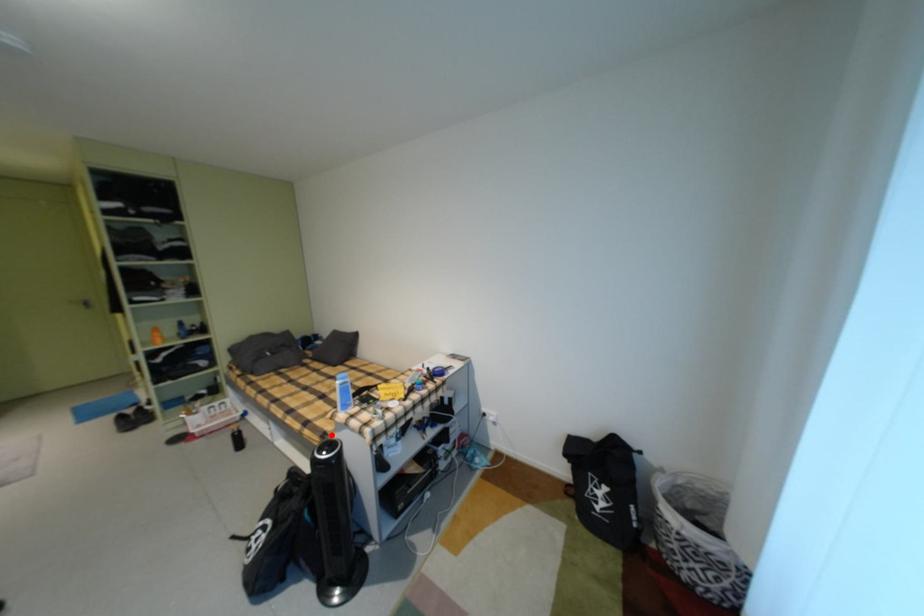
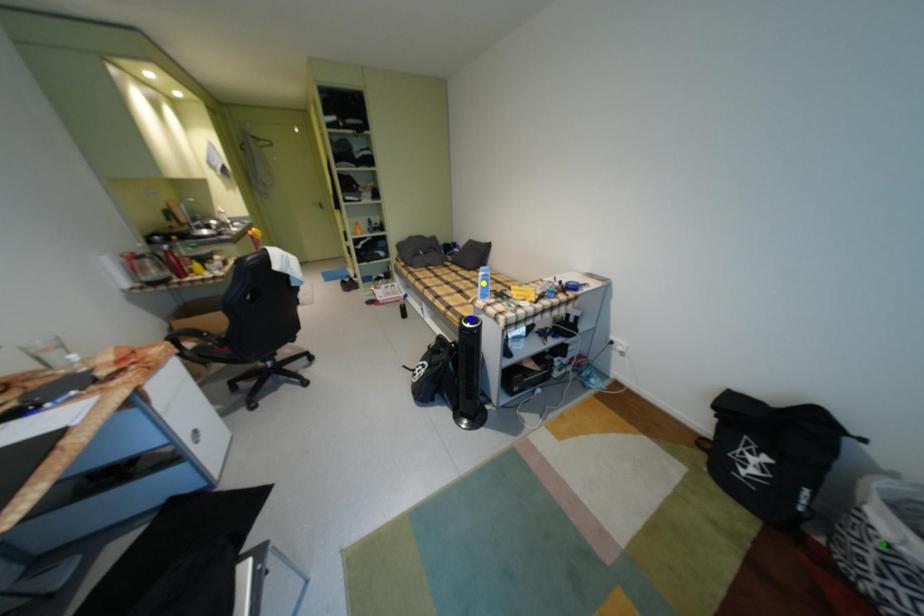
Question: I am providing you with two images of the same scene from different viewpoints. A red point is marked on the first image. You are given multiple points on the second image. Which point in image 2 is actually the same real-world point as the red point in image 1?

Choices:
 (A) green point
 (B) blue point
 (C) yellow point

Answer: (B)